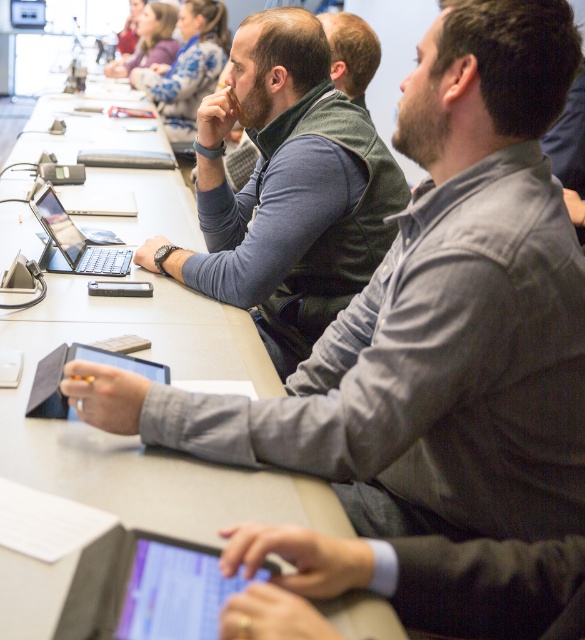
Question: Which of the following is the farthest from the observer?

Choices:
 (A) matte black jacket at upper left
 (B) matte black laptop at center
 (C) gray matte table at center

Answer: (A)

Question: Which point is closer to the camera?

Choices:
 (A) (359, 108)
 (B) (25, 296)
 (C) (102, 252)

Answer: (B)

Question: Does matte green vest at center appear on the right side of matte black jacket at upper left?

Choices:
 (A) no
 (B) yes

Answer: (B)

Question: Which is nearer to the matte black jacket at upper left?

Choices:
 (A) gray matte table at center
 (B) black matte tablet at center
 (C) matte blue shirt at center
 (D) matte green vest at center

Answer: (D)

Question: Can you confirm if black matte tablet at center is positioned above matte black jacket at upper left?

Choices:
 (A) no
 (B) yes

Answer: (A)

Question: Is black matte tablet at center to the left of matte black laptop at center from the viewer's perspective?

Choices:
 (A) yes
 (B) no

Answer: (B)